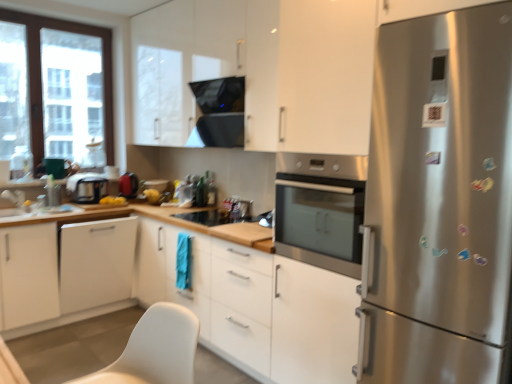
Question: Does white glossy cabinet at upper center, which ranks as the 4th cabinetry in bottom-to-top order, have a greater width compared to white glossy sink at lower left?

Choices:
 (A) no
 (B) yes

Answer: (B)

Question: Can you confirm if white glossy cabinet at upper center, which ranks as the 4th cabinetry in bottom-to-top order, is bigger than white glossy sink at lower left?

Choices:
 (A) yes
 (B) no

Answer: (A)

Question: Is white glossy cabinet at upper center, which ranks as the 4th cabinetry in bottom-to-top order, closer to camera compared to white glossy sink at lower left?

Choices:
 (A) no
 (B) yes

Answer: (B)

Question: Is the position of white glossy cabinet at upper center, which ranks as the 4th cabinetry in bottom-to-top order, more distant than that of white glossy sink at lower left?

Choices:
 (A) no
 (B) yes

Answer: (A)

Question: Is white glossy sink at lower left located within white glossy cabinet at upper center, which ranks as the 1th cabinetry in top-to-bottom order?

Choices:
 (A) yes
 (B) no

Answer: (B)

Question: Would you say clear glass window at left is inside or outside white matte cabinet at lower left, the 2th cabinetry viewed from the top?

Choices:
 (A) inside
 (B) outside

Answer: (B)

Question: In terms of height, does clear glass window at left look taller or shorter compared to white matte cabinet at lower left, which is the 3th cabinetry in bottom-to-top order?

Choices:
 (A) short
 (B) tall

Answer: (B)

Question: In the image, is clear glass window at left positioned in front of or behind white matte cabinet at lower left, which is the 3th cabinetry in bottom-to-top order?

Choices:
 (A) behind
 (B) front

Answer: (A)

Question: From a real-world perspective, is clear glass window at left above or below white matte cabinet at lower left, which is the 3th cabinetry in bottom-to-top order?

Choices:
 (A) above
 (B) below

Answer: (A)

Question: From their relative heights in the image, would you say white matte cabinet at center, the fourth cabinetry viewed from the top, is taller or shorter than white glossy cabinet at upper center, which ranks as the 1th cabinetry in top-to-bottom order?

Choices:
 (A) tall
 (B) short

Answer: (B)

Question: In the image, is white matte cabinet at center, the first cabinetry ordered from the bottom, positioned in front of or behind white glossy cabinet at upper center, which ranks as the 4th cabinetry in bottom-to-top order?

Choices:
 (A) front
 (B) behind

Answer: (A)

Question: In terms of size, does white matte cabinet at center, the fourth cabinetry viewed from the top, appear bigger or smaller than white glossy cabinet at upper center, which ranks as the 4th cabinetry in bottom-to-top order?

Choices:
 (A) big
 (B) small

Answer: (A)

Question: From a real-world perspective, is white matte cabinet at center, the fourth cabinetry viewed from the top, physically located above or below white glossy cabinet at upper center, which ranks as the 1th cabinetry in top-to-bottom order?

Choices:
 (A) below
 (B) above

Answer: (A)

Question: Considering the positions of black glass exhaust hood at upper center and clear glass window at left in the image, is black glass exhaust hood at upper center wider or thinner than clear glass window at left?

Choices:
 (A) wide
 (B) thin

Answer: (A)

Question: Visually, is black glass exhaust hood at upper center positioned to the left or to the right of clear glass window at left?

Choices:
 (A) left
 (B) right

Answer: (B)